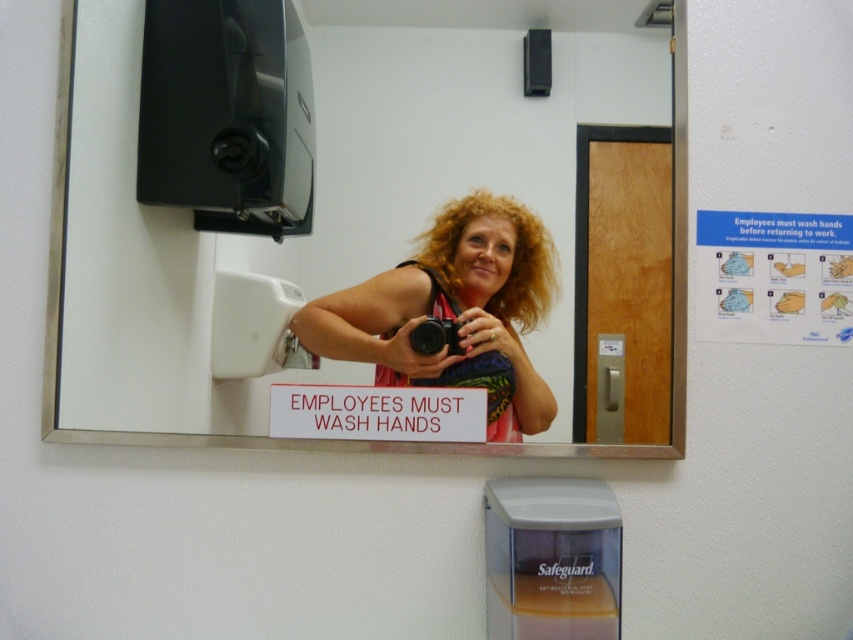
Looking at this image, you are standing in the bathroom and want to read the white plastic sign at center. Which direction should you turn your head to look at it from the white glossy mirror at upper center?

The white glossy mirror at upper center is to the left of the white plastic sign at center, so you should turn your head to the right to look at the white plastic sign at center from the white glossy mirror at upper center.

You are standing in the bathroom and want to take a photo of the multicolored fabric at center and the black plastic camera at center. Which object should you focus on first if you want to capture both clearly in one shot?

The multicolored fabric at center is further to the viewer than the black plastic camera at center, so you should focus on the multicolored fabric at center first to ensure both are in focus.

You are standing in the bathroom and want to place a new decorative item between the multicolored fabric at center and the black plastic camera at center. Which object should you place it closer to if you want it to be closer to the wall?

The multicolored fabric at center is wider than the black plastic camera at center, so placing the decorative item closer to the multicolored fabric at center would position it nearer to the wall.